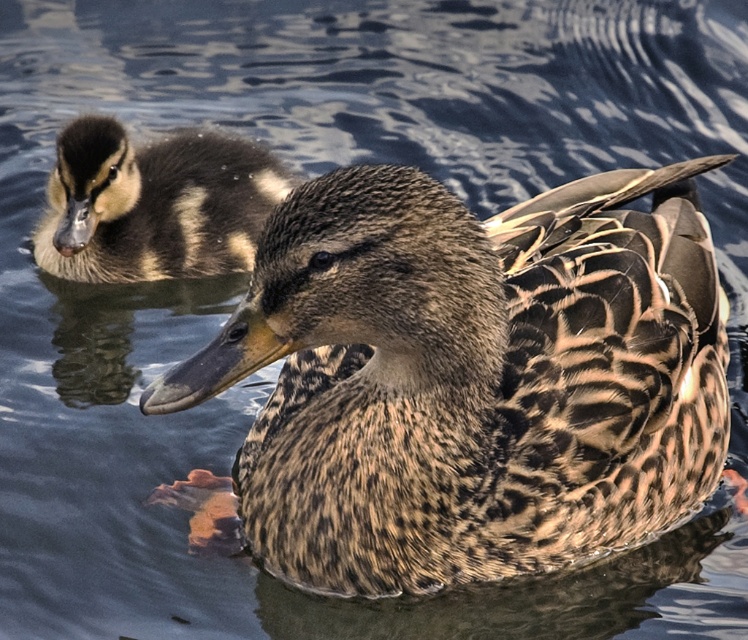
Is brown speckled duck at center taller than brown speckled duckling at upper left?

Yes.

Which is below, brown speckled duck at center or brown speckled duckling at upper left?

Positioned lower is brown speckled duck at center.

Where is `brown speckled duck at center`? brown speckled duck at center is located at coordinates (468, 378).